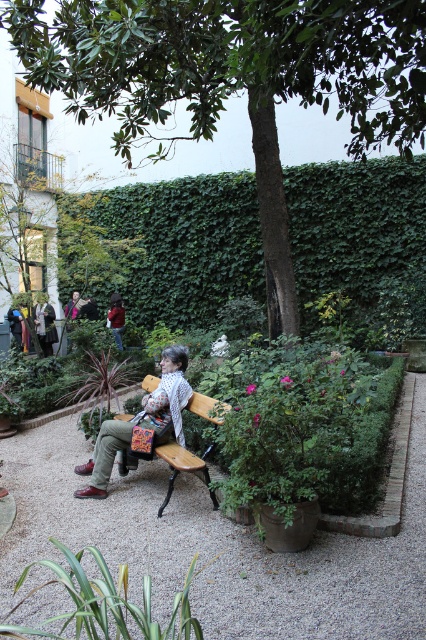
Question: Can you confirm if green ivy hedge at center is positioned above matte brown leather jacket at center?

Choices:
 (A) yes
 (B) no

Answer: (A)

Question: Is green ivy hedge at center positioned before matte brown leather jacket at center?

Choices:
 (A) no
 (B) yes

Answer: (A)

Question: Estimate the real-world distances between objects in this image. Which object is farther from the green ivy hedge at center?

Choices:
 (A) matte brown leather jacket at center
 (B) wooden bench at center

Answer: (B)

Question: Which object is the farthest from the matte brown leather jacket at center?

Choices:
 (A) wooden bench at center
 (B) green ivy hedge at center

Answer: (B)

Question: Is green ivy hedge at center behind wooden bench at center?

Choices:
 (A) no
 (B) yes

Answer: (B)

Question: Estimate the real-world distances between objects in this image. Which object is farther from the wooden bench at center?

Choices:
 (A) matte brown leather jacket at center
 (B) green ivy hedge at center

Answer: (B)